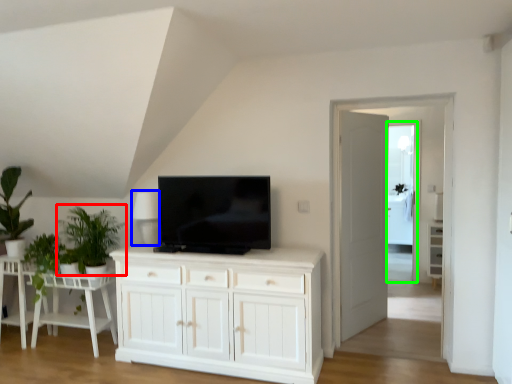
Question: Considering the real-world distances, which object is closest to plant (highlighted by a red box)? lamp (highlighted by a blue box) or glass door (highlighted by a green box).

Choices:
 (A) lamp
 (B) glass door

Answer: (A)